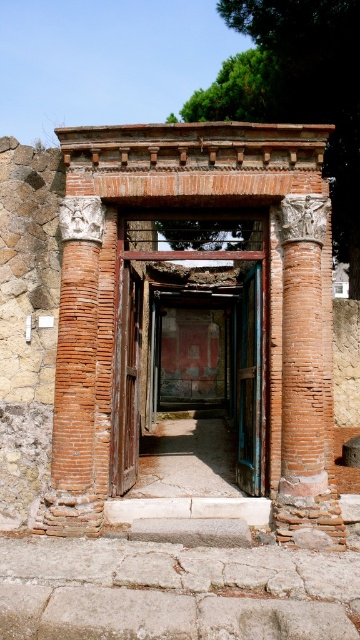
Question: Based on their relative distances, which object is nearer to the wooden slats door at center?

Choices:
 (A) blue painted wood door at center
 (B) brick/reddish-brown stone archway at center

Answer: (A)

Question: Is brick/reddish-brown stone archway at center to the left of wooden slats door at center from the viewer's perspective?

Choices:
 (A) yes
 (B) no

Answer: (B)

Question: Is brick/reddish-brown stone archway at center to the right of rustic wooden door at center from the viewer's perspective?

Choices:
 (A) yes
 (B) no

Answer: (B)

Question: Which object appears closest to the camera in this image?

Choices:
 (A) brick/reddish-brown stone archway at center
 (B) wooden slats door at center
 (C) rustic wooden door at center

Answer: (A)

Question: Which object is the closest to the rustic wooden door at center?

Choices:
 (A) blue painted wood door at center
 (B) wooden slats door at center
 (C) brick/reddish-brown stone archway at center

Answer: (B)

Question: Does wooden slats door at center appear under blue painted wood door at center?

Choices:
 (A) yes
 (B) no

Answer: (B)